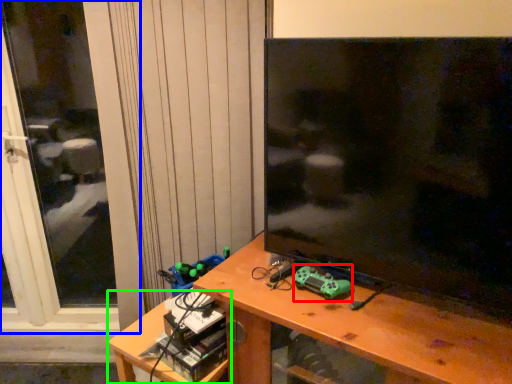
Question: Which object is positioned farthest from toy (highlighted by a red box)? Select from screen door (highlighted by a blue box) and table (highlighted by a green box).

Choices:
 (A) screen door
 (B) table

Answer: (A)